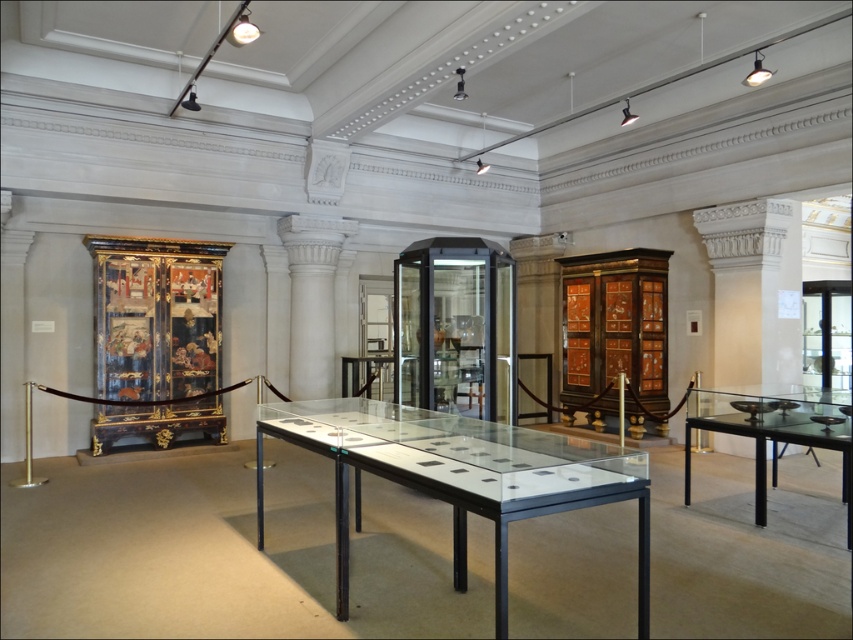
Who is higher up, clear glass table at center or black glass table at right?

black glass table at right is above.

I want to click on clear glass table at center, so click(x=459, y=476).

I want to click on clear glass table at center, so click(459, 476).